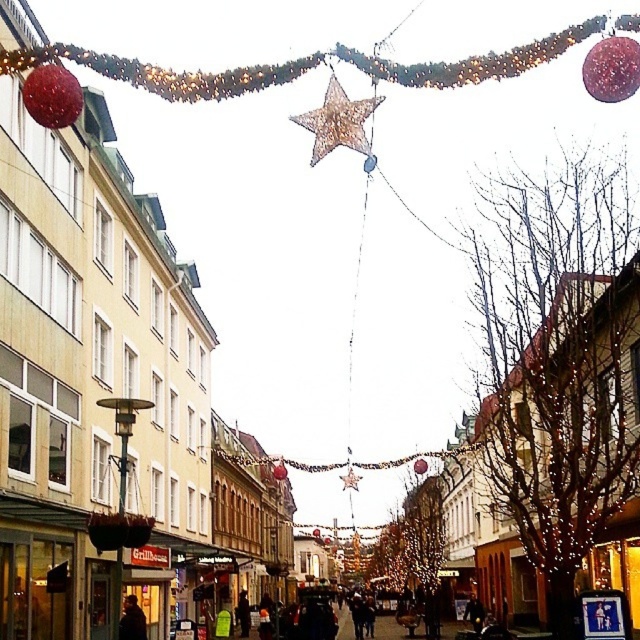
Is glittery gold star at center positioned behind metallic gold star at center?

That is False.

Between glittery gold star at center and metallic gold star at center, which one appears on the left side from the viewer's perspective?

glittery gold star at center

I want to click on glittery gold star at center, so click(337, 122).

The height and width of the screenshot is (640, 640). What are the coordinates of `glittery gold star at center` in the screenshot? It's located at (337, 122).